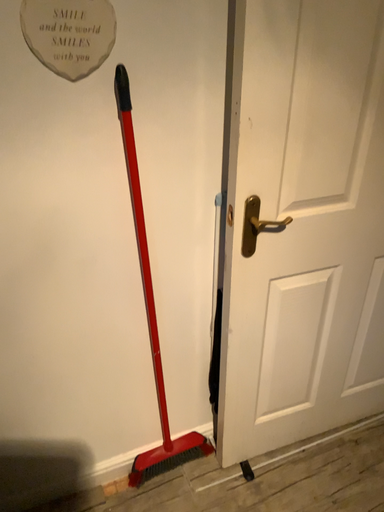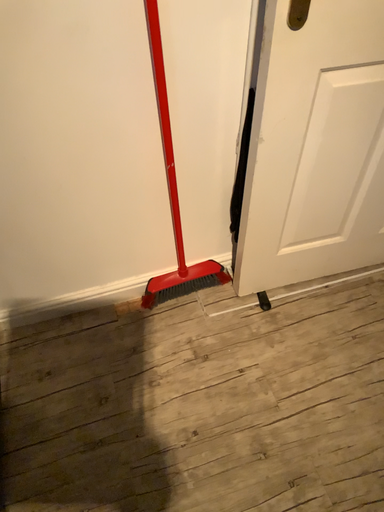
Question: Which way did the camera rotate in the video?

Choices:
 (A) rotated upward
 (B) rotated downward

Answer: (B)